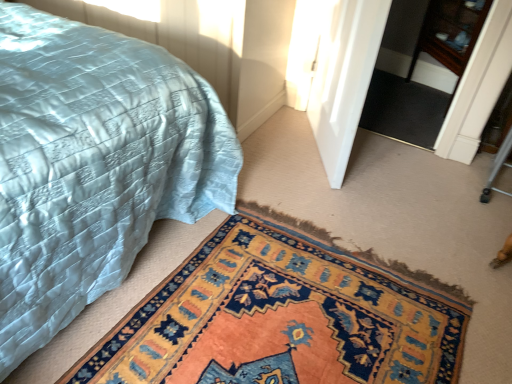
Question: Looking at their shapes, would you say matte blue quilt at lower left is wider or thinner than wooden dresser at upper right?

Choices:
 (A) thin
 (B) wide

Answer: (B)

Question: Do you think matte blue quilt at lower left is within wooden dresser at upper right, or outside of it?

Choices:
 (A) inside
 (B) outside

Answer: (B)

Question: Which object is positioned farthest from the matte blue quilt at lower left?

Choices:
 (A) white glossy door at center
 (B) carpeted mat at lower center
 (C) wooden dresser at upper right
 (D) black carpet at center

Answer: (C)

Question: Which object is the farthest from the white glossy door at center?

Choices:
 (A) carpeted mat at lower center
 (B) black carpet at center
 (C) wooden dresser at upper right
 (D) matte blue quilt at lower left

Answer: (C)